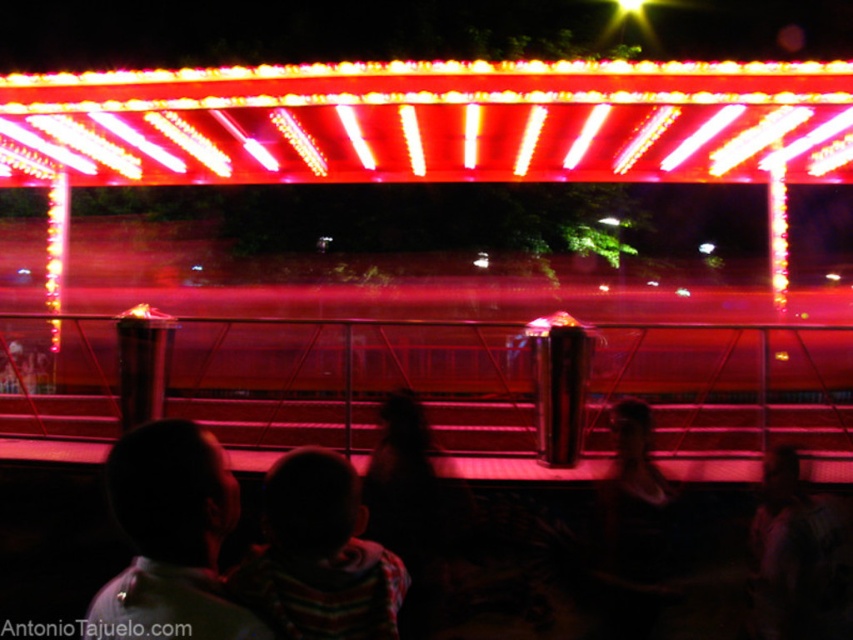
Who is more distant from viewer, (253, 630) or (305, 529)?

The point (305, 529) is more distant.

Identify the location of dark hair at lower left. [171, 540].

Which is more to the left, bright red neon lights at upper center or striped sweater at center?

bright red neon lights at upper center

Can you confirm if bright red neon lights at upper center is positioned below striped sweater at center?

Incorrect, bright red neon lights at upper center is not positioned below striped sweater at center.

Between point (408, 177) and point (354, 474), which one is positioned behind?

The point (408, 177) is more distant.

You are a GUI agent. You are given a task and a screenshot of the screen. Output one action in this format:
    pyautogui.click(x=<x>, y=<y>)
    Task: Click on the bright red neon lights at upper center
    
    Given the screenshot: What is the action you would take?
    pyautogui.click(x=431, y=122)

Can you confirm if bright red neon lights at upper center is positioned above dark hair at lower left?

Yes.

Is bright red neon lights at upper center to the right of dark hair at lower left from the viewer's perspective?

Indeed, bright red neon lights at upper center is positioned on the right side of dark hair at lower left.

Describe the element at coordinates (431, 122) in the screenshot. I see `bright red neon lights at upper center` at that location.

This screenshot has width=853, height=640. Identify the location of bright red neon lights at upper center. (431, 122).